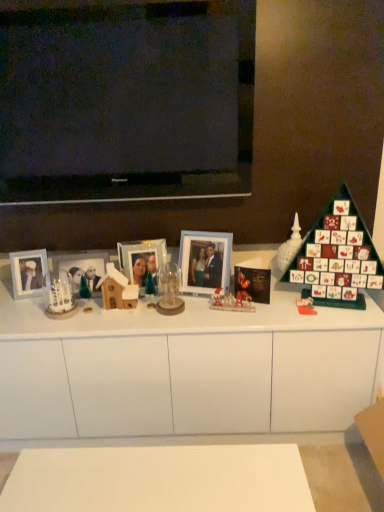
Identify the location of vacant space to the left of matte plastic toy at right, arranged as the first toy when viewed from the right. The width and height of the screenshot is (384, 512). (271, 310).